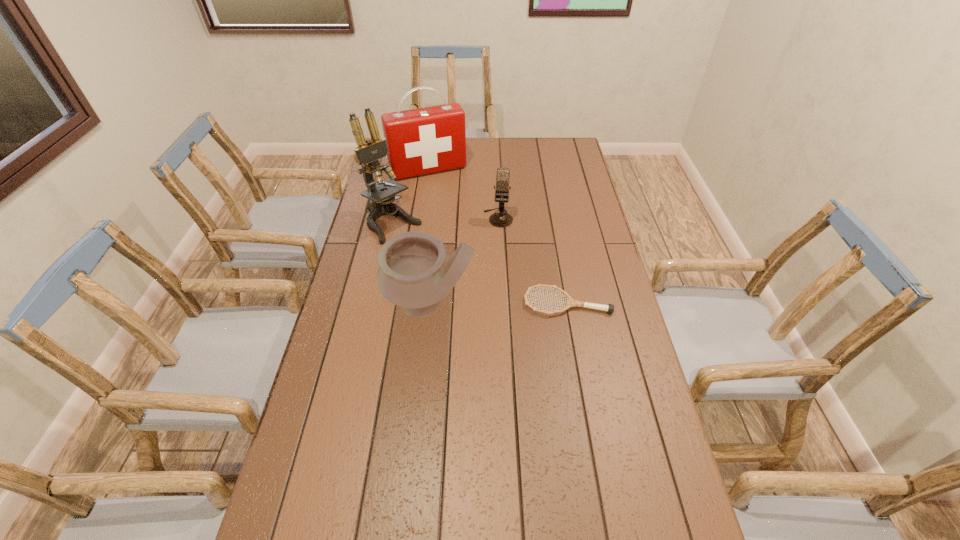
You are a GUI agent. You are given a task and a screenshot of the screen. Output one action in this format:
    pyautogui.click(x=<x>, y=<y>)
    Task: Click on the pottery located at the left edge
    This screenshot has width=960, height=540.
    Given the screenshot: What is the action you would take?
    pyautogui.click(x=415, y=272)

This screenshot has width=960, height=540. In order to click on the first-aid kit present at the left edge in this screenshot , I will do `click(422, 141)`.

Identify the location of microscope at the left edge. This screenshot has width=960, height=540. (367, 154).

Where is `object situated at the right edge`? This screenshot has height=540, width=960. object situated at the right edge is located at coordinates (609, 308).

Image resolution: width=960 pixels, height=540 pixels. Identify the location of object located at the far left corner. (422, 141).

Locate an element on the screen. blank space at the far edge of the desktop is located at coordinates (515, 141).

The width and height of the screenshot is (960, 540). Find the location of `vacant space at the left edge of the desktop`. vacant space at the left edge of the desktop is located at coordinates (369, 320).

You are a GUI agent. You are given a task and a screenshot of the screen. Output one action in this format:
    pyautogui.click(x=<x>, y=<y>)
    Task: Click on the vacant space at the right edge of the desktop
    This screenshot has height=540, width=960.
    Given the screenshot: What is the action you would take?
    pyautogui.click(x=561, y=170)

You are a GUI agent. You are given a task and a screenshot of the screen. Output one action in this format:
    pyautogui.click(x=<x>, y=<y>)
    Task: Click on the free point between the microscope and the second shortest object
    This screenshot has width=960, height=540.
    Given the screenshot: What is the action you would take?
    pos(445,221)

Identify the location of free spot between the microscope and the second object from right to left. Image resolution: width=960 pixels, height=540 pixels. (445, 221).